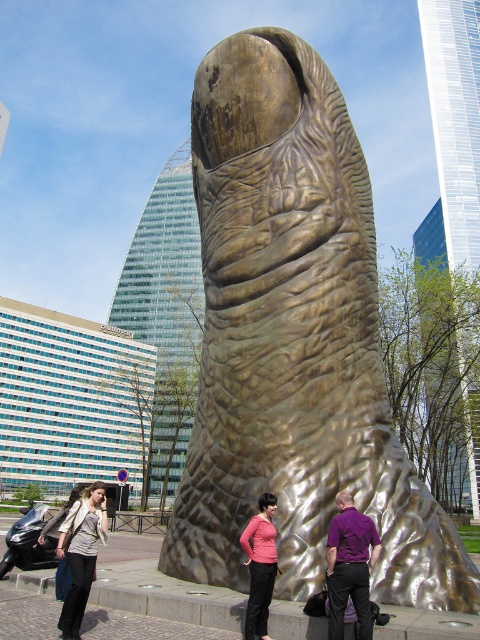
Can you confirm if gold textured finger at center is positioned below pink matte shirt at center?

Actually, gold textured finger at center is above pink matte shirt at center.

Is gold textured finger at center smaller than pink matte shirt at center?

No, gold textured finger at center is not smaller than pink matte shirt at center.

Who is more distant from viewer, (330,336) or (272,589)?

The point (330,336) is more distant.

You are a GUI agent. You are given a task and a screenshot of the screen. Output one action in this format:
    pyautogui.click(x=<x>, y=<y>)
    Task: Click on the gold textured finger at center
    
    Given the screenshot: What is the action you would take?
    pyautogui.click(x=295, y=339)

Which of these two, purple matte shirt at center or matte gray jacket at lower left, stands shorter?

purple matte shirt at center

Is purple matte shirt at center thinner than matte gray jacket at lower left?

Correct, purple matte shirt at center's width is less than matte gray jacket at lower left's.

Is point (338, 538) positioned in front of point (82, 512)?

Yes.

Where is `purple matte shirt at center`? This screenshot has width=480, height=640. purple matte shirt at center is located at coordinates (349, 564).

Is matte gray jacket at lower left further to camera compared to pink matte shirt at center?

Yes, matte gray jacket at lower left is further from the viewer.

Who is more forward, (63, 618) or (255, 561)?

Point (63, 618)

This screenshot has width=480, height=640. Identify the location of matte gray jacket at lower left. (81, 554).